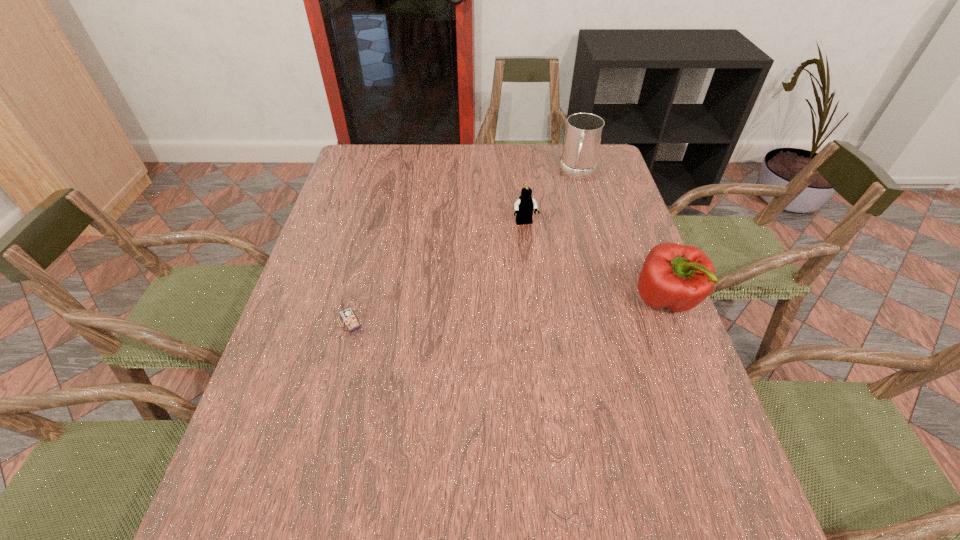
Where is `vacant area that lies between the leftmost object and the bell pepper`? The image size is (960, 540). vacant area that lies between the leftmost object and the bell pepper is located at coordinates (508, 310).

The image size is (960, 540). In order to click on free area in between the bell pepper and the matchbox in this screenshot , I will do `click(508, 310)`.

Where is `vacant space in between the bell pepper and the third nearest object`? vacant space in between the bell pepper and the third nearest object is located at coordinates (595, 262).

Locate an element on the screen. This screenshot has height=540, width=960. object that ranks as the third closest to the mug is located at coordinates (345, 313).

Locate an element on the screen. This screenshot has height=540, width=960. object identified as the second closest to the leftmost object is located at coordinates (679, 277).

Find the location of a particular element. free spot that satisfies the following two spatial constraints: 1. on the back side of the Lego; 2. on the left side of the matchbox is located at coordinates (375, 224).